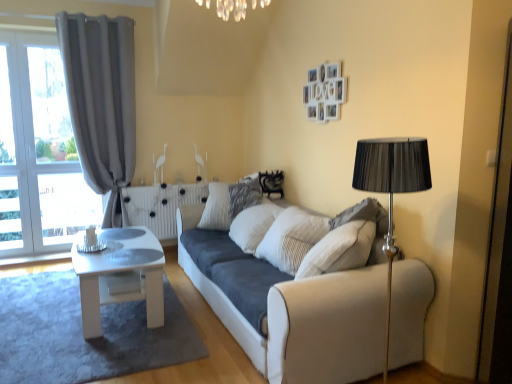
Where is `vacant area on top of white glossy coffee table at lower left (from a real-world perspective)`? The height and width of the screenshot is (384, 512). vacant area on top of white glossy coffee table at lower left (from a real-world perspective) is located at coordinates (66, 304).